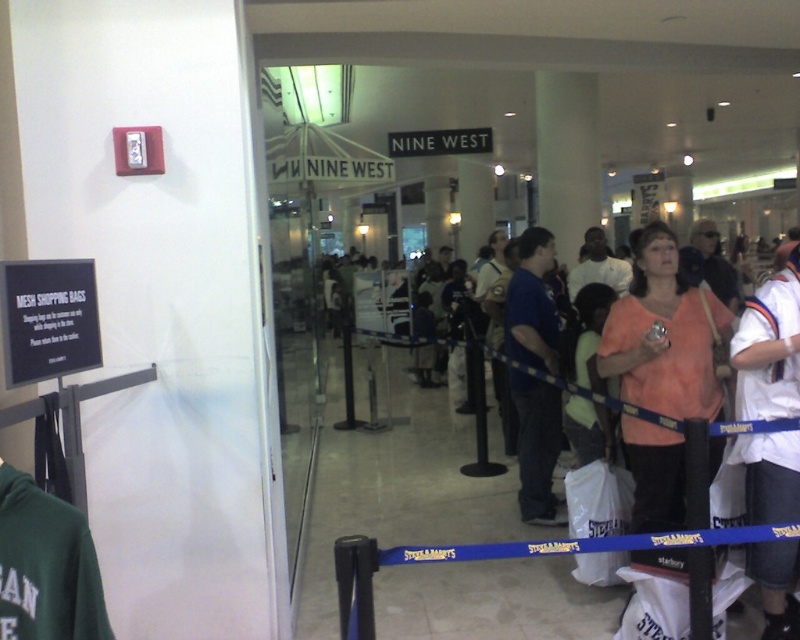
Question: Which object is farther from the camera taking this photo?

Choices:
 (A) blue cotton shirt at center
 (B) white cotton shirt at center

Answer: (A)

Question: Among these points, which one is nearest to the camera?

Choices:
 (A) (533, 291)
 (B) (741, 365)

Answer: (B)

Question: Considering the relative positions of white cotton shirt at center and blue cotton shirt at center in the image provided, where is white cotton shirt at center located with respect to blue cotton shirt at center?

Choices:
 (A) above
 (B) below

Answer: (B)

Question: Is white cotton shirt at center below blue cotton shirt at center?

Choices:
 (A) no
 (B) yes

Answer: (B)

Question: Can you confirm if white cotton shirt at center is positioned above blue cotton shirt at center?

Choices:
 (A) yes
 (B) no

Answer: (B)